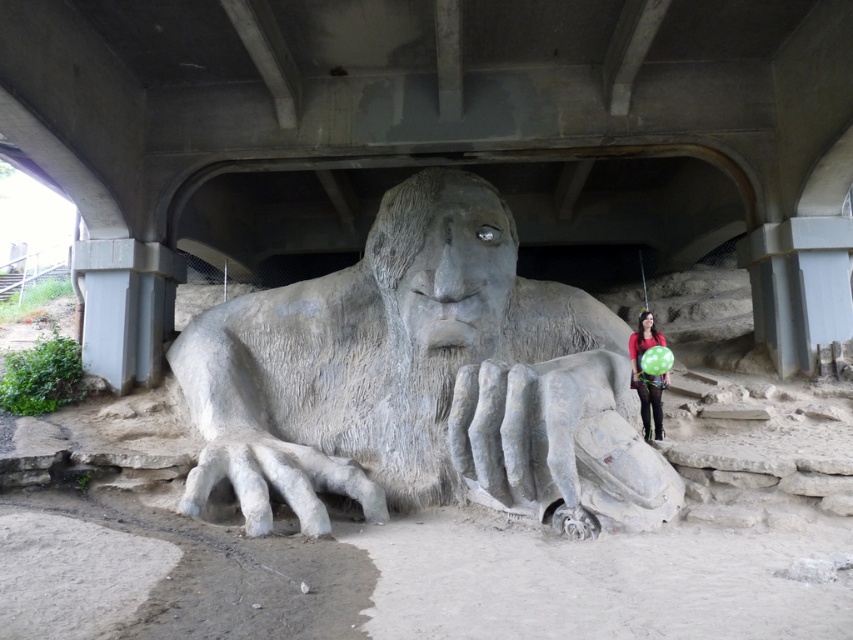
Question: Which object is closer to the camera taking this photo?

Choices:
 (A) matte black dress at lower right
 (B) stone statue at center
 (C) concrete at center

Answer: (B)

Question: Is stone statue at center thinner than matte black dress at lower right?

Choices:
 (A) yes
 (B) no

Answer: (B)

Question: Where is stone statue at center located in relation to matte black dress at lower right in the image?

Choices:
 (A) below
 (B) above

Answer: (A)

Question: Can you confirm if concrete at center is wider than matte black dress at lower right?

Choices:
 (A) yes
 (B) no

Answer: (A)

Question: Which of the following is the farthest from the observer?

Choices:
 (A) (218, 458)
 (B) (122, 188)

Answer: (B)

Question: Among these objects, which one is nearest to the camera?

Choices:
 (A) matte black dress at lower right
 (B) concrete at center

Answer: (A)